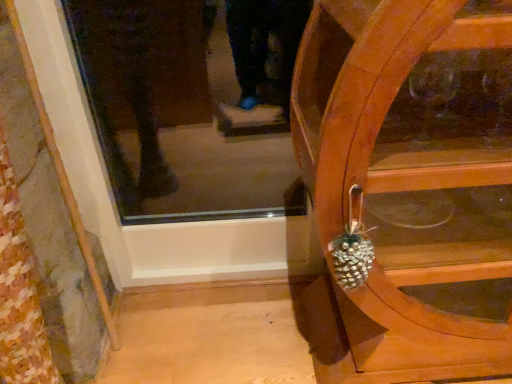
I want to click on vacant space situated on the left part of wooden cabinet at right, so click(218, 326).